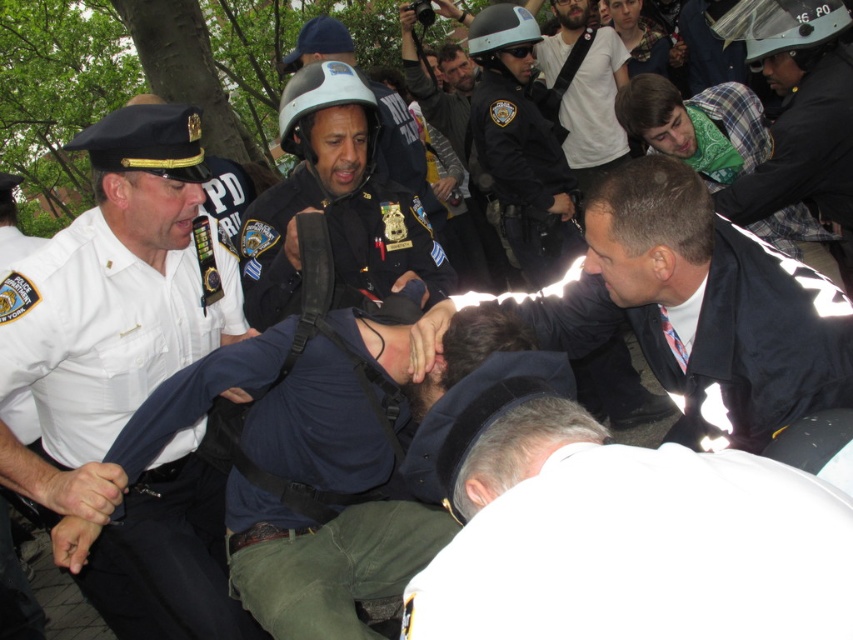
Is point (132, 400) farther from camera compared to point (379, 198)?

No, (132, 400) is in front of (379, 198).

Looking at this image, between white uniform shirt at left and matte black helmet at center, which one has less height?

Standing shorter between the two is matte black helmet at center.

Find the location of a particular element. white uniform shirt at left is located at coordinates (128, 374).

Does point (808, 483) come behind point (328, 83)?

That is False.

Who is positioned more to the right, white matte shirt at lower center or matte black helmet at center?

white matte shirt at lower center

Which is behind, point (648, 534) or point (383, 259)?

Point (383, 259)

I want to click on white matte shirt at lower center, so click(618, 529).

Between dark blue shirt at center and matte black helmet at center, which one is positioned lower?

dark blue shirt at center is lower down.

Which of these two, dark blue shirt at center or matte black helmet at center, stands shorter?

dark blue shirt at center is shorter.

Does point (280, 435) lie in front of point (281, 289)?

Yes.

Identify the location of dark blue shirt at center. (323, 561).